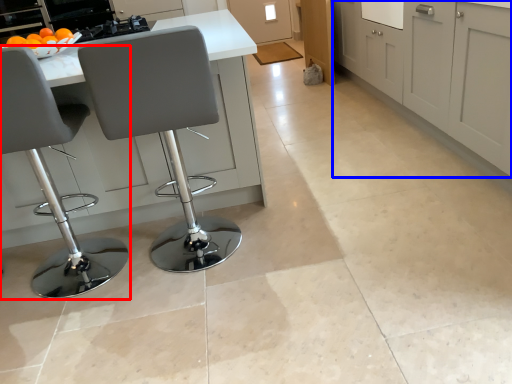
Question: Among these objects, which one is nearest to the camera, chair (highlighted by a red box) or cabinetry (highlighted by a blue box)?

Choices:
 (A) chair
 (B) cabinetry

Answer: (A)